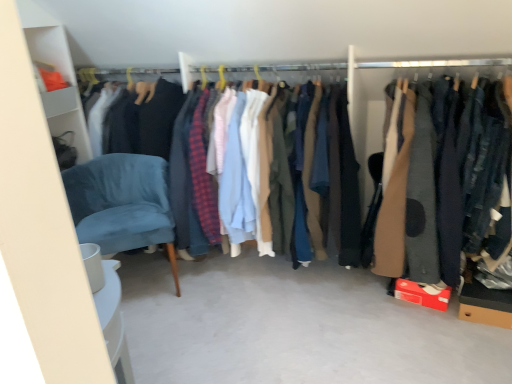
Where is `free location in front of velvet blue chair at lower left`? free location in front of velvet blue chair at lower left is located at coordinates pos(169,338).